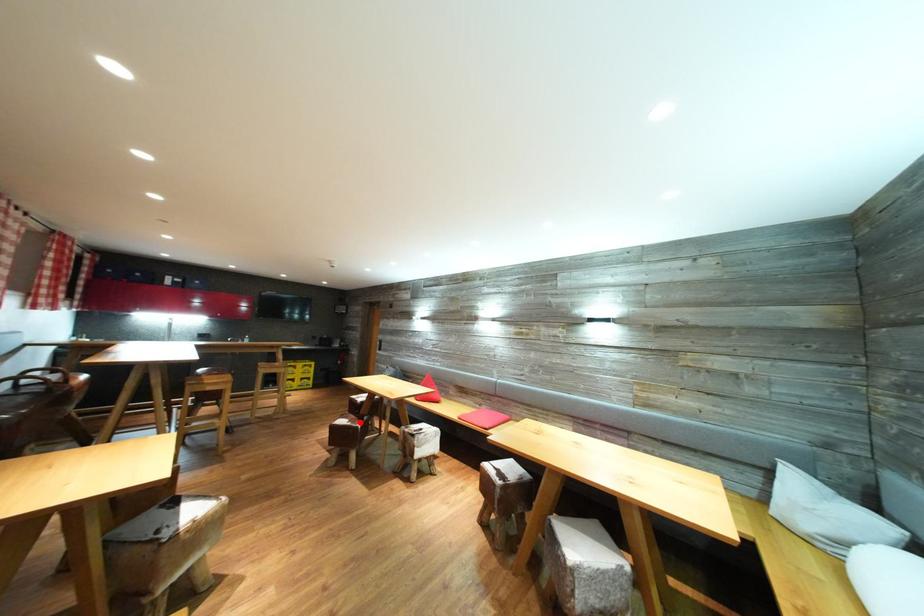
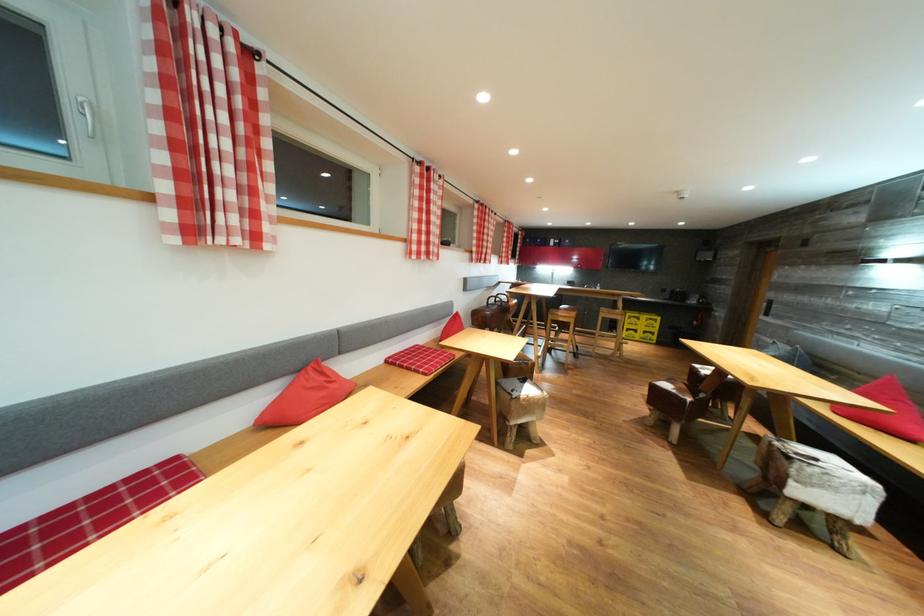
Locate, in the second image, the point that corresponds to the highlighted location in the first image.

(689, 392)